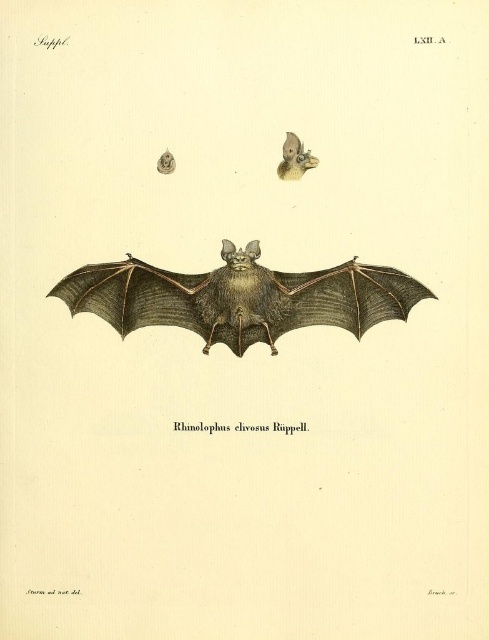
Question: Which point is closer to the camera taking this photo?

Choices:
 (A) (180, 317)
 (B) (279, 173)

Answer: (B)

Question: Which of the following is the closest to the observer?

Choices:
 (A) (296, 163)
 (B) (149, 307)

Answer: (A)

Question: Can you confirm if brown textured bat at center is positioned above smooth beige bat head at upper center?

Choices:
 (A) yes
 (B) no

Answer: (B)

Question: Is brown textured bat at center below smooth beige bat head at upper center?

Choices:
 (A) yes
 (B) no

Answer: (A)

Question: Does brown textured bat at center appear under smooth beige bat head at upper center?

Choices:
 (A) no
 (B) yes

Answer: (B)

Question: Which point is farther from the camera taking this photo?

Choices:
 (A) pos(113,268)
 (B) pos(294,136)

Answer: (B)